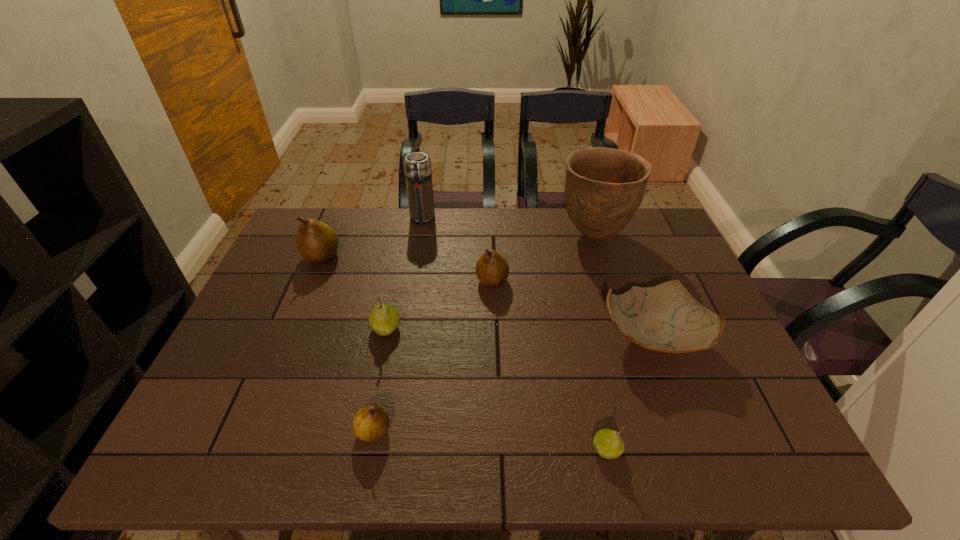
At what (x,y) coordinates should I click in order to perform the action: click on the second brown pear from left to right. Please return your answer as a coordinate pair (x, y). Image resolution: width=960 pixels, height=540 pixels. Looking at the image, I should click on (371, 422).

Identify the location of the rightmost pear. (608, 443).

Locate an element on the screen. the nearer green pear is located at coordinates (608, 443).

The height and width of the screenshot is (540, 960). In order to click on free space located 0.400m on the left of the taller pottery in this screenshot , I will do `click(435, 235)`.

Image resolution: width=960 pixels, height=540 pixels. I want to click on vacant position located with a handle on the side of the thermos bottle, so click(408, 305).

Locate an element on the screen. This screenshot has width=960, height=540. vacant space positioned on the right of the biggest brown pear is located at coordinates (416, 257).

The width and height of the screenshot is (960, 540). Find the location of `free space located 0.350m on the right of the fourth pear from left to right`. free space located 0.350m on the right of the fourth pear from left to right is located at coordinates (629, 281).

Where is `blank area located 0.130m on the right of the left green pear`? The height and width of the screenshot is (540, 960). blank area located 0.130m on the right of the left green pear is located at coordinates (451, 328).

You are a GUI agent. You are given a task and a screenshot of the screen. Output one action in this format:
    pyautogui.click(x=<x>, y=<y>)
    Task: Click on the vacant space situated on the back of the nearer pottery
    Image resolution: width=960 pixels, height=540 pixels.
    Given the screenshot: What is the action you would take?
    pyautogui.click(x=611, y=225)

This screenshot has height=540, width=960. I want to click on vacant point located 0.380m on the right of the second brown pear from left to right, so click(x=570, y=431).